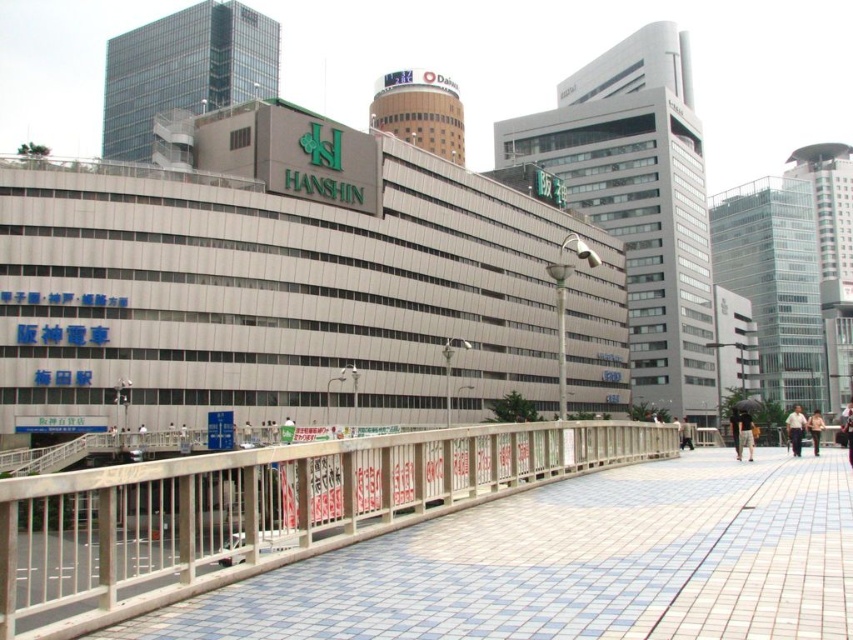
Question: Can you confirm if dark brown leather jacket at center is thinner than light brown leather jacket at lower right?

Choices:
 (A) yes
 (B) no

Answer: (A)

Question: Among these objects, which one is nearest to the camera?

Choices:
 (A) dark brown leather jacket at center
 (B) light brown leather jacket at lower right

Answer: (A)

Question: Is blue tile pavement at lower left to the right of light brown fabric shirt at right from the viewer's perspective?

Choices:
 (A) yes
 (B) no

Answer: (B)

Question: Is blue tile pavement at lower left positioned behind light brown fabric shirt at right?

Choices:
 (A) no
 (B) yes

Answer: (A)

Question: Among these points, which one is nearest to the camera?

Choices:
 (A) (741, 595)
 (B) (798, 426)

Answer: (A)

Question: Which point is farther to the camera?

Choices:
 (A) (799, 422)
 (B) (741, 451)
 (C) (659, 538)

Answer: (A)